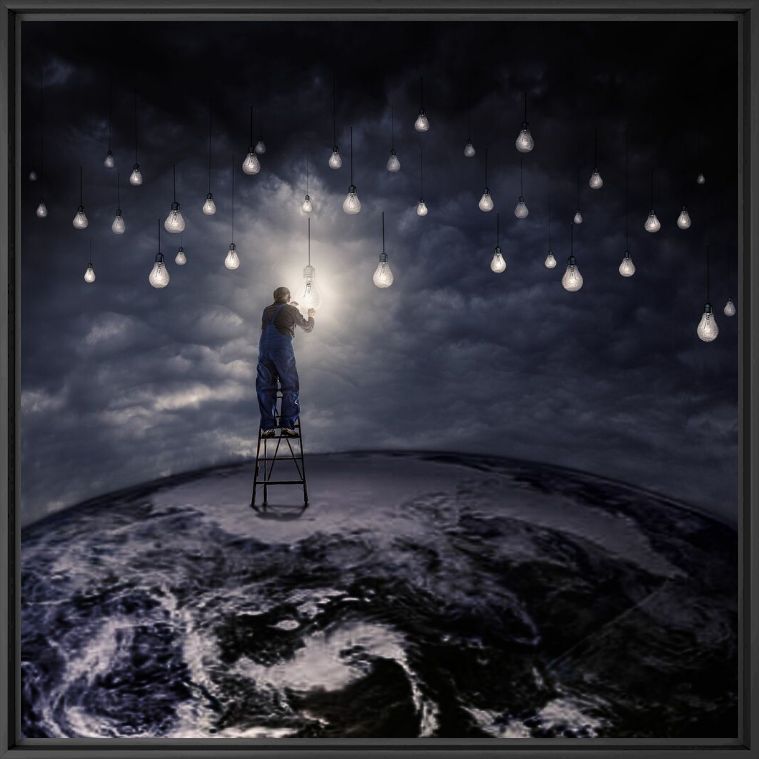
Locate an element on the screen. The width and height of the screenshot is (759, 759). electric wire is located at coordinates (380, 235).